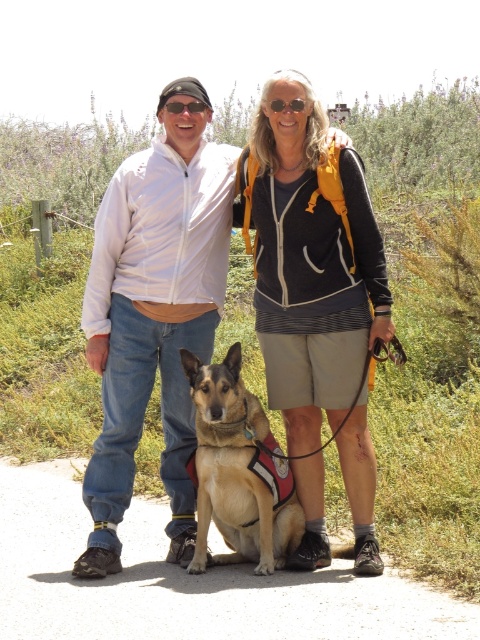
Question: Does matte black jacket at center have a smaller size compared to brown fur dog at center?

Choices:
 (A) yes
 (B) no

Answer: (B)

Question: Based on their relative distances, which object is farther from the black plastic goggles at center?

Choices:
 (A) sunglasses at center
 (B) matte black jacket at center

Answer: (B)

Question: Is matte black jacket at center closer to camera compared to sunglasses at center?

Choices:
 (A) yes
 (B) no

Answer: (A)

Question: Among these objects, which one is nearest to the camera?

Choices:
 (A) brown fur dog at center
 (B) matte black jacket at center
 (C) black plastic goggles at center
 (D) sunglasses at center

Answer: (A)

Question: Which object appears farthest from the camera in this image?

Choices:
 (A) black plastic goggles at center
 (B) brown fur dog at center
 (C) matte gray hoodie at center
 (D) matte black jacket at center

Answer: (A)

Question: Does matte black jacket at center come behind matte gray hoodie at center?

Choices:
 (A) yes
 (B) no

Answer: (A)